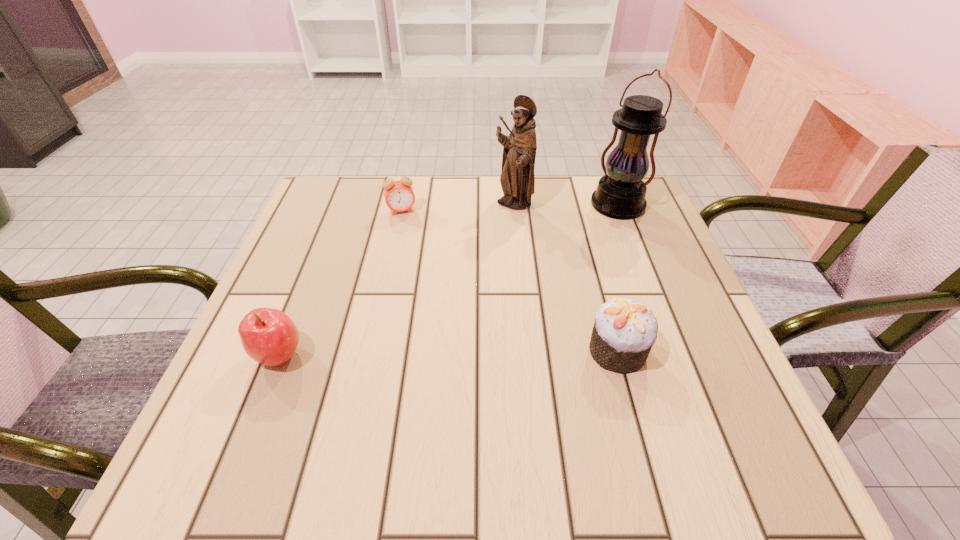
In order to click on free space on the desktop that is between the apple and the cupcake and is positioned above the lantern, indicating its light source in this screenshot , I will do `click(475, 352)`.

Where is `vacant spot on the desktop that is between the leftmost object and the cupcake and is positioned on the face of the second object from left to right`? vacant spot on the desktop that is between the leftmost object and the cupcake and is positioned on the face of the second object from left to right is located at coordinates (441, 353).

Where is `free space on the desktop that is between the apple and the cupcake and is positioned on the front-facing side of the third object from left to right`? free space on the desktop that is between the apple and the cupcake and is positioned on the front-facing side of the third object from left to right is located at coordinates (448, 353).